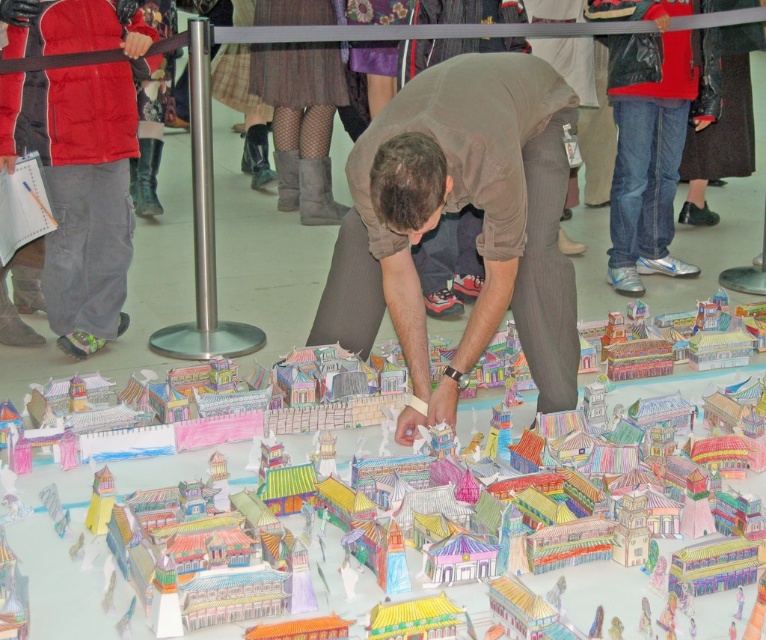
You are standing at the viewpoint of the image and want to know if the point at coordinates point (51, 77) is closer to you or farther away compared to point (31, 515). Based on the scene description, which point is farther from you?

Point (51, 77) is behind point (31, 515), so it is farther away from you.

You are standing in front of the paper model of the traditional East Asian cityscape. You see the brown fabric squat at center and the red jacket at left. Which object is located more to the left?

The red jacket at left is more to the left than the brown fabric squat at center.

You are a visitor at an art exhibition and want to take a photo of the brown fabric squat at center and the red jacket at left together in the same frame. Given that your camera has a maximum focus range of 6 feet, will you be able to capture both objects in one shot without moving the camera?

The brown fabric squat at center and the red jacket at left are 6.01 feet apart from each other, which exceeds the camera maximum focus range of 6 feet. Therefore, you cannot capture both objects in one shot without moving the camera.